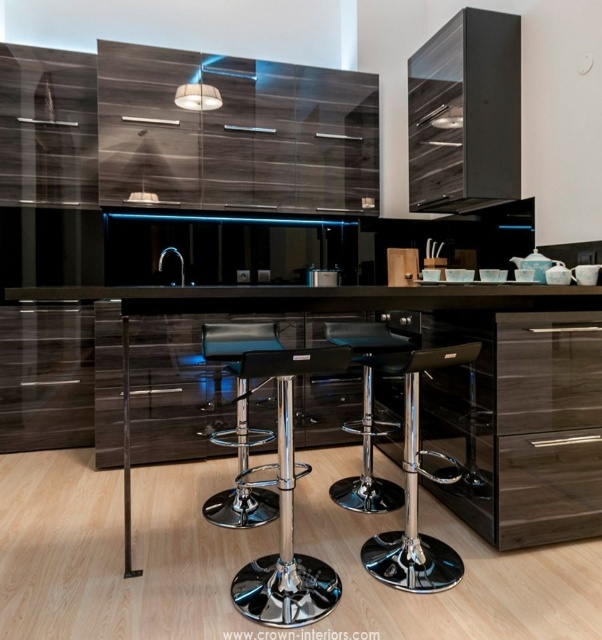
Question: Among these objects, which one is farthest from the camera?

Choices:
 (A) satin black toaster at center
 (B) chrome/black bar stool at center

Answer: (A)

Question: Is glossy wood exhaust hood at upper center bigger than polished chrome bar stool at center?

Choices:
 (A) yes
 (B) no

Answer: (B)

Question: Is black chrome bar stool at center smaller than satin black toaster at center?

Choices:
 (A) no
 (B) yes

Answer: (A)

Question: Based on their relative distances, which object is farther from the black leather bar stool at center?

Choices:
 (A) black chrome bar stool at center
 (B) black glossy counter top at center

Answer: (B)

Question: Estimate the real-world distances between objects in this image. Which object is farther from the glossy wood exhaust hood at upper center?

Choices:
 (A) black chrome bar stool at center
 (B) polished chrome bar stool at center

Answer: (A)

Question: Does black chrome bar stool at center come behind black leather bar stool at center?

Choices:
 (A) no
 (B) yes

Answer: (A)